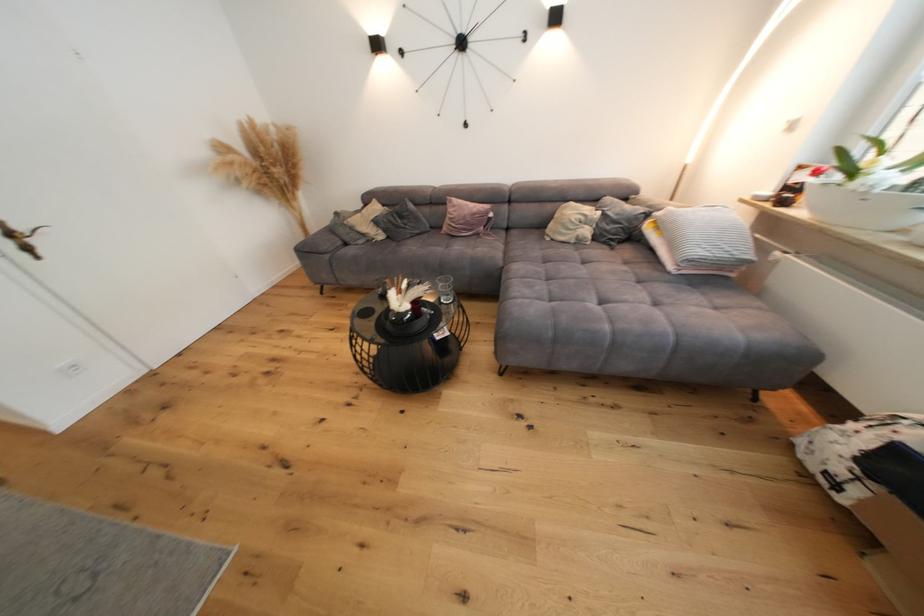
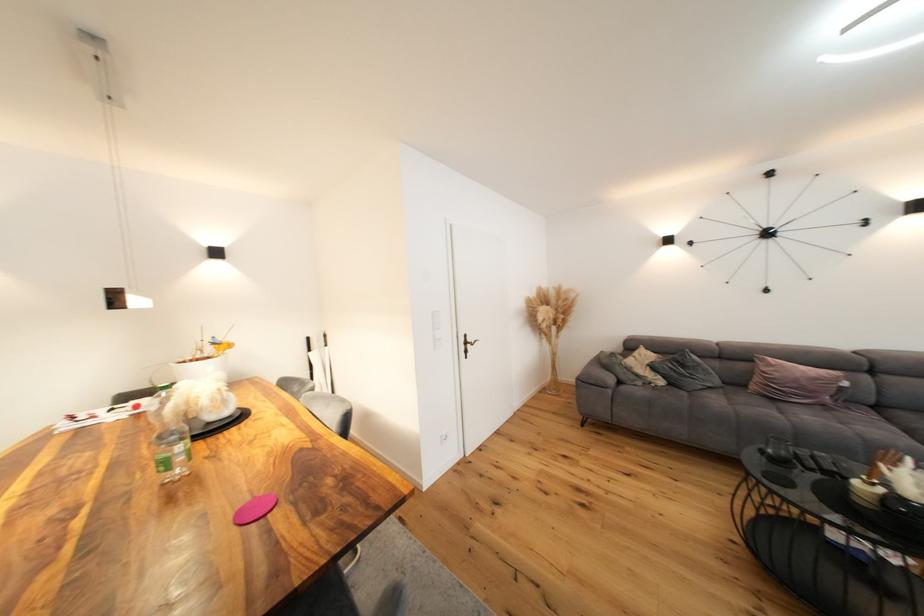
Where in the second image is the point corresponding to point 432,238 from the first image?

(727, 392)